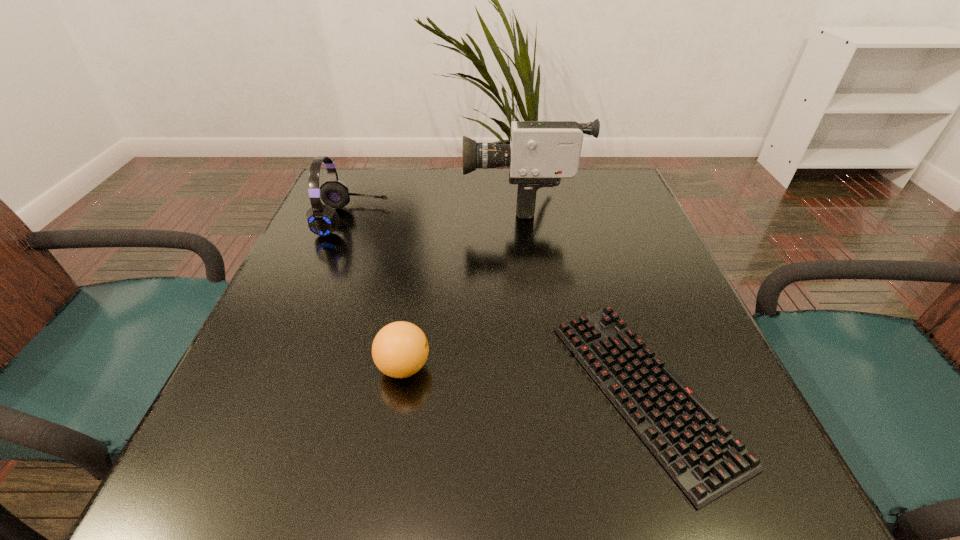
Where is `object that is positioned at the near right corner`? This screenshot has width=960, height=540. object that is positioned at the near right corner is located at coordinates (700, 453).

Locate an element on the screen. This screenshot has width=960, height=540. vacant space at the far edge of the desktop is located at coordinates (442, 176).

The width and height of the screenshot is (960, 540). Identify the location of free space at the near edge of the desktop. (609, 482).

The height and width of the screenshot is (540, 960). In the image, there is a desktop. In order to click on vacant space at the left edge in this screenshot , I will do coord(314,356).

The image size is (960, 540). In the image, there is a desktop. Identify the location of free region at the right edge. point(636,221).

This screenshot has height=540, width=960. In order to click on vacant space at the far left corner in this screenshot , I will do `click(387, 167)`.

What are the coordinates of `vacant region at the near left corner of the desktop` in the screenshot? It's located at (202, 459).

In order to click on vacant point at the far right corner in this screenshot , I will do `click(618, 170)`.

Locate an element on the screen. The width and height of the screenshot is (960, 540). blank space at the near right corner is located at coordinates (754, 447).

At what (x,y) coordinates should I click in order to perform the action: click on vacant area between the shortest object and the second object from left to right. Please return your answer as a coordinate pair (x, y). Looking at the image, I should click on (523, 379).